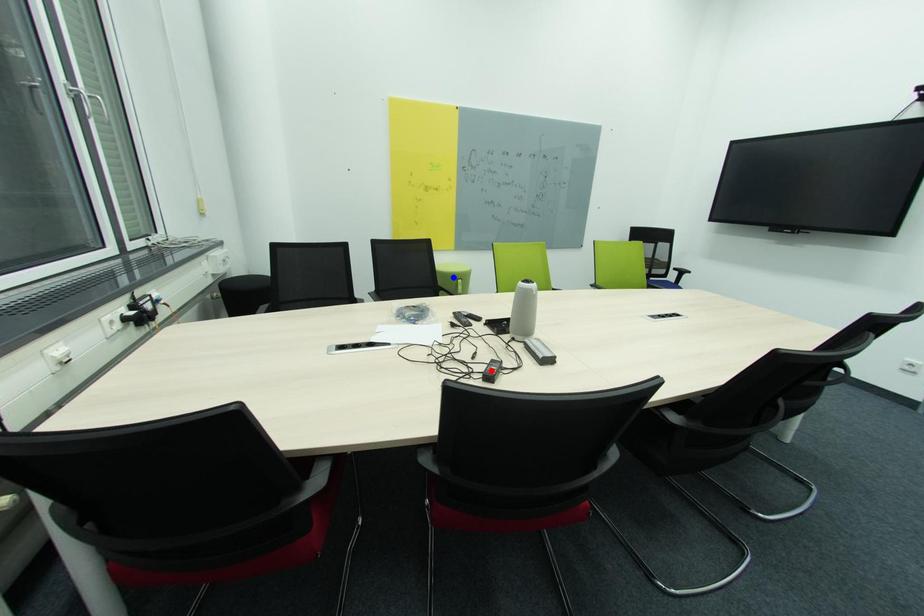
Question: Two points are marked on the image. Which point is closer to the camera?

Choices:
 (A) Blue point is closer.
 (B) Red point is closer.

Answer: (B)